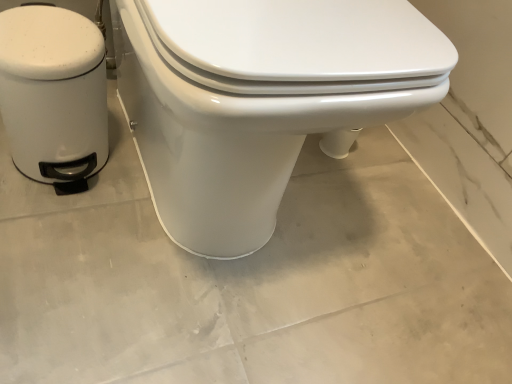
Find the location of a particular element. This screenshot has height=384, width=512. white matte trash can at left is located at coordinates (54, 94).

This screenshot has height=384, width=512. Describe the element at coordinates (54, 94) in the screenshot. I see `white matte trash can at left` at that location.

What is the approximate height of white glossy toilet at center?

It is 20.41 inches.

What do you see at coordinates (261, 100) in the screenshot? The width and height of the screenshot is (512, 384). I see `white glossy toilet at center` at bounding box center [261, 100].

The width and height of the screenshot is (512, 384). I want to click on white glossy toilet at center, so click(261, 100).

In order to click on white matte trash can at left in this screenshot , I will do coord(54,94).

Is white glossy toilet at center to the right of white matte trash can at left from the viewer's perspective?

Yes.

Considering the relative positions of white glossy toilet at center and white matte trash can at left in the image provided, is white glossy toilet at center in front of white matte trash can at left?

Yes, white glossy toilet at center is in front of white matte trash can at left.

Considering the points (204, 18) and (79, 74), which point is in front, point (204, 18) or point (79, 74)?

The point (204, 18) is closer.

From the image's perspective, which one is positioned lower, white glossy toilet at center or white matte trash can at left?

white matte trash can at left.

From a real-world perspective, who is located lower, white glossy toilet at center or white matte trash can at left?

In real-world perspective, white matte trash can at left is lower.

Considering the sizes of objects white glossy toilet at center and white matte trash can at left in the image provided, who is thinner, white glossy toilet at center or white matte trash can at left?

white matte trash can at left is thinner.

Considering the relative sizes of white glossy toilet at center and white matte trash can at left in the image provided, is white glossy toilet at center shorter than white matte trash can at left?

Incorrect, the height of white glossy toilet at center does not fall short of that of white matte trash can at left.

Which of these two, white glossy toilet at center or white matte trash can at left, is smaller?

Smaller between the two is white matte trash can at left.

Can we say white glossy toilet at center lies outside white matte trash can at left?

white glossy toilet at center lies outside white matte trash can at left's area.

Is white glossy toilet at center far from white matte trash can at left?

No, white glossy toilet at center is not far away from white matte trash can at left.

Looking at this image, is white glossy toilet at center facing away from white matte trash can at left?

white glossy toilet at center does not have its back to white matte trash can at left.

How many degrees apart are the facing directions of white glossy toilet at center and white matte trash can at left?

white glossy toilet at center and white matte trash can at left are facing 0.0011 degrees away from each other.

Where is `water heater located below the white glossy toilet at center (from the image's perspective)`? The width and height of the screenshot is (512, 384). water heater located below the white glossy toilet at center (from the image's perspective) is located at coordinates (54, 94).

Between white matte trash can at left and white glossy toilet at center, which one appears on the left side from the viewer's perspective?

Positioned to the left is white matte trash can at left.

Considering the relative positions of white matte trash can at left and white glossy toilet at center in the image provided, is white matte trash can at left in front of white glossy toilet at center?

No, white matte trash can at left is further to the viewer.

Which point is more distant from viewer, (x=18, y=137) or (x=353, y=35)?

The point (x=18, y=137) is farther from the camera.

From the image's perspective, which is below, white matte trash can at left or white glossy toilet at center?

From the image's view, white matte trash can at left is below.

From a real-world perspective, between white matte trash can at left and white glossy toilet at center, who is vertically higher?

From a 3D spatial view, white glossy toilet at center is above.

Between white matte trash can at left and white glossy toilet at center, which one has smaller width?

Thinner between the two is white matte trash can at left.

Is white matte trash can at left taller than white glossy toilet at center?

Incorrect, the height of white matte trash can at left is not larger of that of white glossy toilet at center.

Is white matte trash can at left smaller than white glossy toilet at center?

Correct, white matte trash can at left occupies less space than white glossy toilet at center.

Is white matte trash can at left completely or partially outside of white glossy toilet at center?

That's correct, white matte trash can at left is outside of white glossy toilet at center.

Is there a large distance between white matte trash can at left and white glossy toilet at center?

No, there isn't a large distance between white matte trash can at left and white glossy toilet at center.

Is white matte trash can at left oriented away from white glossy toilet at center?

No, white glossy toilet at center is not at the back of white matte trash can at left.

How far apart are white matte trash can at left and white glossy toilet at center?

A distance of 21.99 centimeters exists between white matte trash can at left and white glossy toilet at center.

You are a GUI agent. You are given a task and a screenshot of the screen. Output one action in this format:
    pyautogui.click(x=<x>, y=<y>)
    Task: Click on the toilet in front of the white matte trash can at left
    The image size is (512, 384).
    Given the screenshot: What is the action you would take?
    pyautogui.click(x=261, y=100)

I want to click on water heater below the white glossy toilet at center (from the image's perspective), so click(54, 94).

This screenshot has width=512, height=384. Identify the location of toilet above the white matte trash can at left (from the image's perspective). (261, 100).